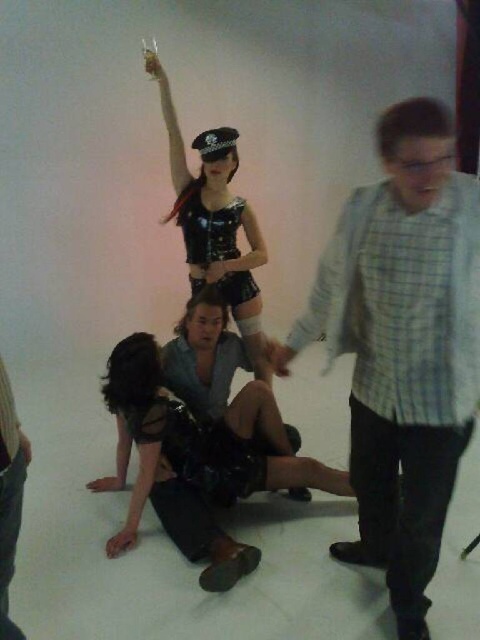
Which is below, light blue plaid shirt at right or leather-like black dress at center?

light blue plaid shirt at right

Is light blue plaid shirt at right further to the viewer compared to leather-like black dress at center?

No, it is in front of leather-like black dress at center.

The width and height of the screenshot is (480, 640). Find the location of `light blue plaid shirt at right`. light blue plaid shirt at right is located at coordinates (403, 346).

You are a GUI agent. You are given a task and a screenshot of the screen. Output one action in this format:
    pyautogui.click(x=<x>, y=<y>)
    Task: Click on the light blue plaid shirt at right
    This screenshot has width=480, height=640.
    Given the screenshot: What is the action you would take?
    pyautogui.click(x=403, y=346)

Which is more to the left, shiny leather vest at center or leather black dress at center?

shiny leather vest at center

Can you confirm if shiny leather vest at center is positioned above leather black dress at center?

Yes, shiny leather vest at center is above leather black dress at center.

This screenshot has width=480, height=640. Describe the element at coordinates (216, 221) in the screenshot. I see `shiny leather vest at center` at that location.

Locate an element on the screen. The image size is (480, 640). shiny leather vest at center is located at coordinates (216, 221).

Which of these two, light blue plaid shirt at right or shiny leather vest at center, stands shorter?

light blue plaid shirt at right

Is point (369, 268) in front of point (148, 72)?

Yes, it is in front of point (148, 72).

Which is behind, point (422, 406) or point (243, 218)?

Positioned behind is point (243, 218).

I want to click on light blue plaid shirt at right, so click(403, 346).